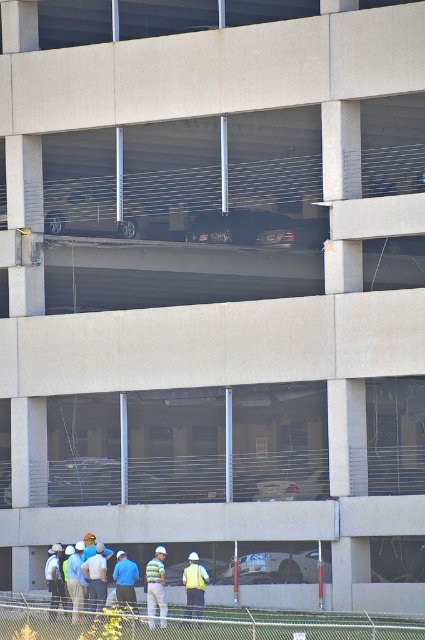
Can you confirm if reflective yellow vest at center is bigger than reflective yellow safety vest at lower center?

No, reflective yellow vest at center is not bigger than reflective yellow safety vest at lower center.

Consider the image. Is reflective yellow vest at center smaller than reflective yellow safety vest at lower center?

Yes.

Where is `reflective yellow vest at center`? The image size is (425, 640). reflective yellow vest at center is located at coordinates (195, 586).

Is reflective yellow vest at center taller than blue fabric shirt at lower center?

Incorrect, reflective yellow vest at center's height is not larger of blue fabric shirt at lower center's.

From the picture: Can you confirm if reflective yellow vest at center is wider than blue fabric shirt at lower center?

No, reflective yellow vest at center is not wider than blue fabric shirt at lower center.

In order to click on reflective yellow vest at center in this screenshot , I will do `click(195, 586)`.

Is blue fabric shirt at lower center to the left of reflective yellow safety vest at lower center from the viewer's perspective?

Yes, blue fabric shirt at lower center is to the left of reflective yellow safety vest at lower center.

Looking at this image, is blue fabric shirt at lower center smaller than reflective yellow safety vest at lower center?

Incorrect, blue fabric shirt at lower center is not smaller in size than reflective yellow safety vest at lower center.

Identify the location of blue fabric shirt at lower center. (124, 580).

You are a GUI agent. You are given a task and a screenshot of the screen. Output one action in this format:
    pyautogui.click(x=<x>, y=<y>)
    Task: Click on the blue fabric shirt at lower center
    This screenshot has width=425, height=640.
    Given the screenshot: What is the action you would take?
    pyautogui.click(x=124, y=580)